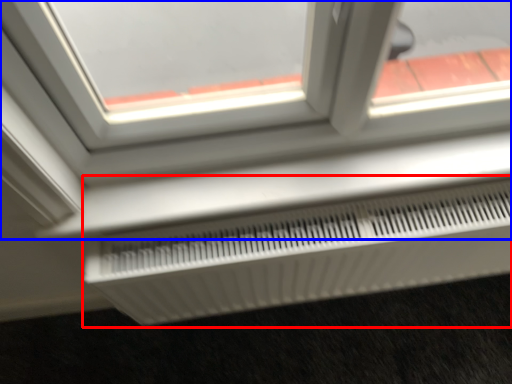
Question: Which point is further to the camera, air conditioning (highlighted by a red box) or window (highlighted by a blue box)?

Choices:
 (A) air conditioning
 (B) window

Answer: (A)